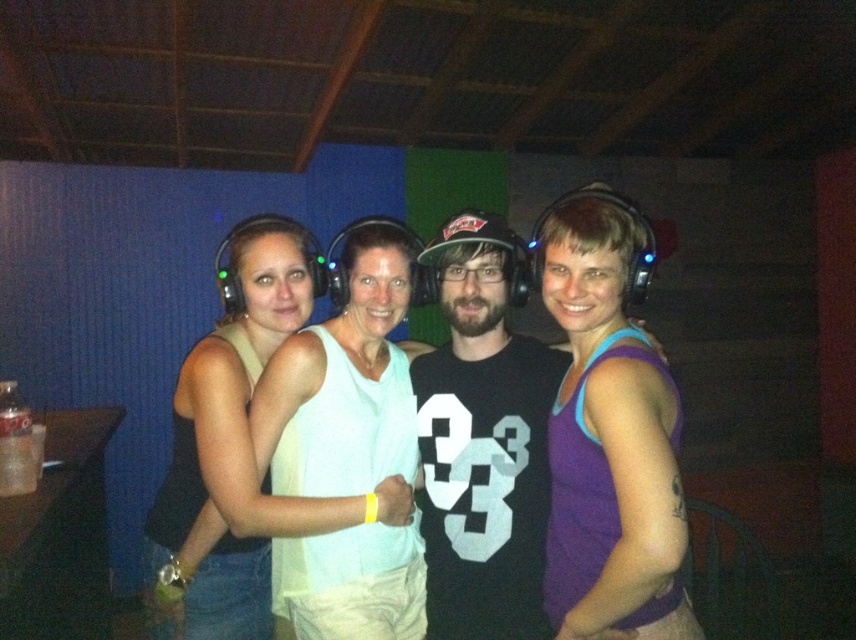
You are standing at point A located at coordinates point A at (x=572, y=516). You want to walk to the door located at point B at 0.669, 0.809. The distance between you and the door is 1.46 meters. Can you walk directly to the door without any obstacles?

Yes, you can walk directly to the door located at point B at 0.669, 0.809 because the distance between you and the door is 1.46 meters, which is a clear path.